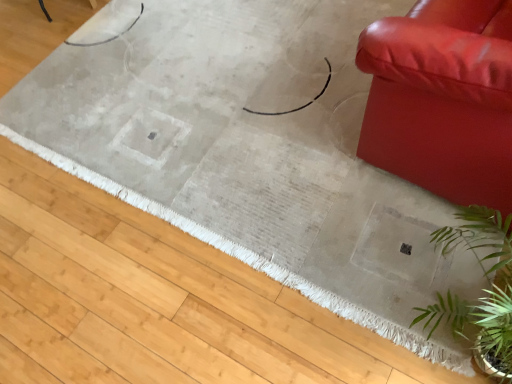
This screenshot has height=384, width=512. I want to click on free space to the left of green leafy plant at lower right, so click(x=331, y=313).